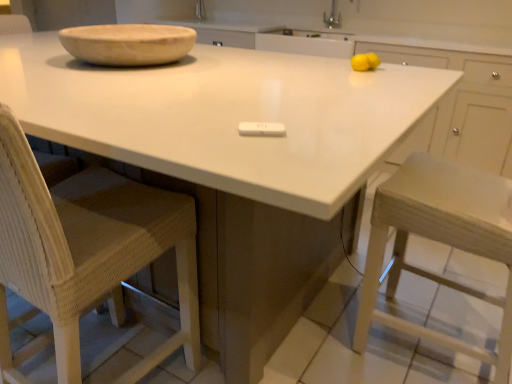
Question: Considering the positions of wooden bowl at upper left and white glossy countertop at center in the image, is wooden bowl at upper left bigger or smaller than white glossy countertop at center?

Choices:
 (A) small
 (B) big

Answer: (A)

Question: From a real-world perspective, is wooden bowl at upper left above or below white glossy countertop at center?

Choices:
 (A) above
 (B) below

Answer: (A)

Question: Which object is the closest to the white glossy countertop at center?

Choices:
 (A) wooden bowl at upper left
 (B) woven wood chair at left

Answer: (A)

Question: Considering the real-world distances, which object is farthest from the wooden bowl at upper left?

Choices:
 (A) woven wood chair at left
 (B) white glossy countertop at center

Answer: (A)